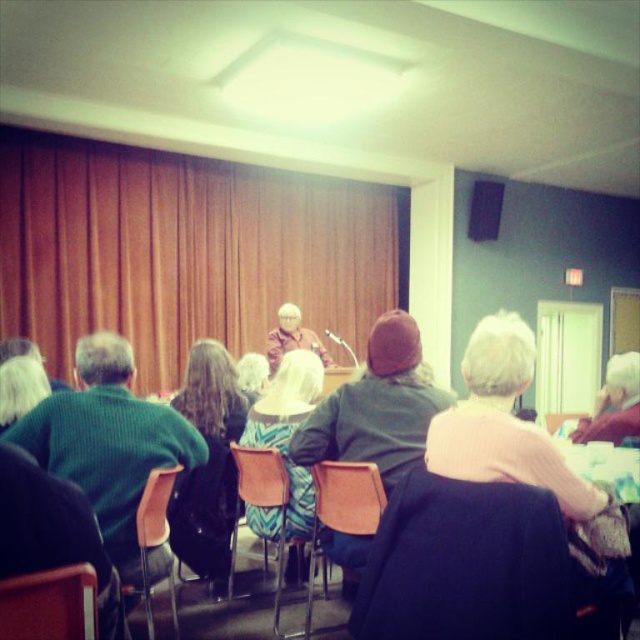
Is patterned fabric dress at center behind matte orange chair at lower left?

Yes, patterned fabric dress at center is behind matte orange chair at lower left.

Find the location of a particular element. This screenshot has height=640, width=640. patterned fabric dress at center is located at coordinates (289, 429).

Find the location of a particular element. The height and width of the screenshot is (640, 640). patterned fabric dress at center is located at coordinates (289, 429).

Does orange fabric chair at lower center have a lesser height compared to matte brown sweater at center?

Yes, orange fabric chair at lower center is shorter than matte brown sweater at center.

Looking at this image, does orange fabric chair at lower center appear over matte brown sweater at center?

No.

The image size is (640, 640). I want to click on orange fabric chair at lower center, so click(465, 564).

Can you confirm if matte brown sweater at center is positioned to the right of matte black speaker at upper center?

Incorrect, matte brown sweater at center is not on the right side of matte black speaker at upper center.

Is matte brown sweater at center closer to the viewer compared to matte black speaker at upper center?

Yes, matte brown sweater at center is closer to the viewer.

Measure the distance between point (275, 369) and camera.

Point (275, 369) is 6.03 meters from camera.

Find the location of `matte brown sweater at center`. matte brown sweater at center is located at coordinates (291, 337).